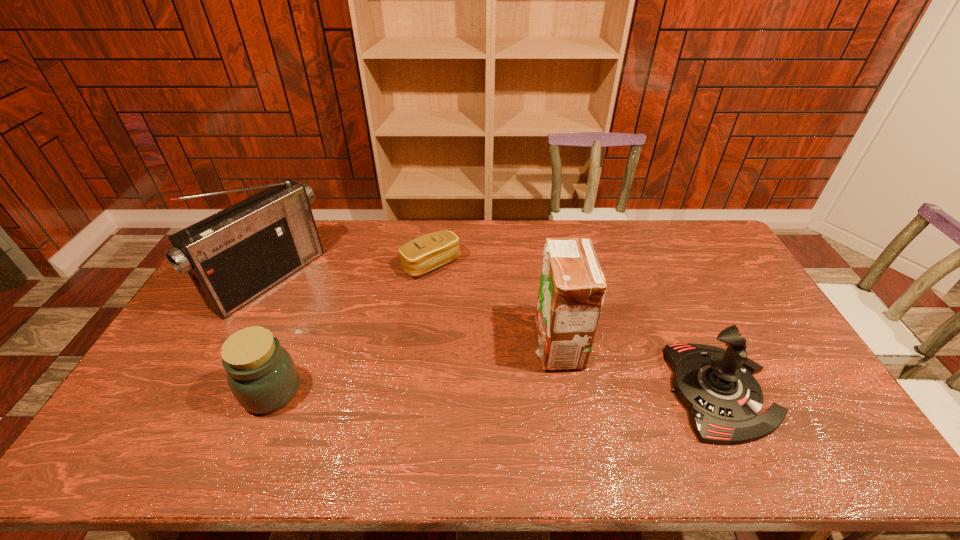
Locate an element on the screen. The height and width of the screenshot is (540, 960). free space located 0.180m on the front-facing side of the tallest object is located at coordinates (336, 329).

This screenshot has height=540, width=960. Identify the location of vacant space located 0.070m on the front-facing side of the tallest object. (313, 314).

Locate an element on the screen. free location located 0.110m on the front-facing side of the tallest object is located at coordinates (321, 319).

At what (x,y) coordinates should I click in order to perform the action: click on free region located on the straw side of the carton. Please return your answer as a coordinate pair (x, y). Looking at the image, I should click on (478, 420).

I want to click on free spot located on the straw side of the carton, so click(484, 415).

Find the location of `vacant space located 0.190m on the straw side of the carton`. vacant space located 0.190m on the straw side of the carton is located at coordinates (495, 405).

You are a GUI agent. You are given a task and a screenshot of the screen. Output one action in this format:
    pyautogui.click(x=<x>, y=<y>)
    Task: Click on the free space located on the zipper side of the clutch bag
    
    Given the screenshot: What is the action you would take?
    pos(513,355)

You are a GUI agent. You are given a task and a screenshot of the screen. Output one action in this format:
    pyautogui.click(x=<x>, y=<y>)
    Task: Click on the vacant space located 0.160m on the zipper side of the clutch bag
    Image resolution: width=960 pixels, height=540 pixels.
    Given the screenshot: What is the action you would take?
    [470, 307]

You are a GUI agent. You are given a task and a screenshot of the screen. Output one action in this format:
    pyautogui.click(x=<x>, y=<y>)
    Task: Click on the free region located 0.270m on the zipper side of the clutch bag
    Image resolution: width=960 pixels, height=540 pixels.
    Given the screenshot: What is the action you would take?
    pyautogui.click(x=490, y=329)

Where is `radio receiver that is at the far edge`? radio receiver that is at the far edge is located at coordinates (235, 255).